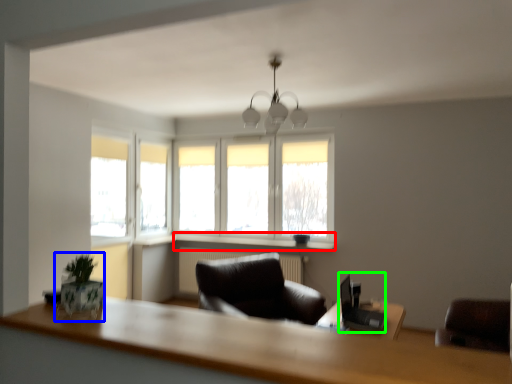
Question: Considering the real-world distances, which object is farthest from window sill (highlighted by a red box)? plant (highlighted by a blue box) or computer desk (highlighted by a green box)?

Choices:
 (A) plant
 (B) computer desk

Answer: (A)